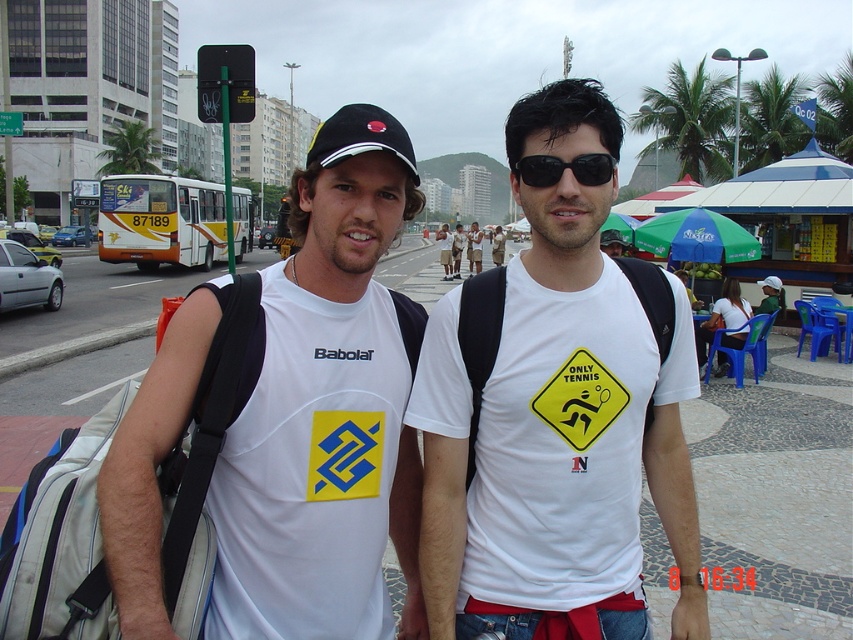
Question: Can you confirm if white matte t-shirt at center is positioned to the right of black plastic sunglasses at center?

Choices:
 (A) yes
 (B) no

Answer: (B)

Question: Does white matte t-shirt at center appear over black matte baseball cap at center?

Choices:
 (A) yes
 (B) no

Answer: (B)

Question: Which of these objects is positioned closest to the white matte t-shirt at center?

Choices:
 (A) black plastic sunglasses at center
 (B) green plastic traffic sign at upper center
 (C) black matte baseball cap at center
 (D) white fabric t-shirt at center

Answer: (D)

Question: Which object is farther from the camera taking this photo?

Choices:
 (A) black plastic sunglasses at center
 (B) white matte t-shirt at center

Answer: (B)

Question: Which of the following is the farthest from the observer?

Choices:
 (A) white cotton shirts at center
 (B) green plastic traffic sign at upper center

Answer: (B)

Question: Considering the relative positions of black plastic sunglasses at center and green plastic traffic sign at upper center in the image provided, where is black plastic sunglasses at center located with respect to green plastic traffic sign at upper center?

Choices:
 (A) above
 (B) below

Answer: (B)